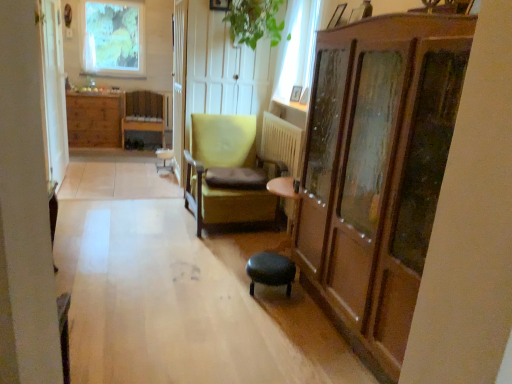
Measure the distance between wooden picture frame at upper right, arranged as the third picture frame when viewed from the front, and camera.

The depth of wooden picture frame at upper right, arranged as the third picture frame when viewed from the front, is 13.57 feet.

Find the location of `brown wood cabinet at left`. brown wood cabinet at left is located at coordinates (94, 120).

Where is `white wooden screen door at center, acting as the second screen door starting from the left`? white wooden screen door at center, acting as the second screen door starting from the left is located at coordinates (x=179, y=85).

This screenshot has height=384, width=512. What do you see at coordinates (271, 270) in the screenshot?
I see `black leather stool at center` at bounding box center [271, 270].

In order to face green fabric bar stool at center, should I rotate leftwards or rightwards?

A 12.160 degree turn to the left will do.

Measure the distance between metallic silver picture frame at upper right, which is counted as the 3th picture frame, starting from the left, and camera.

metallic silver picture frame at upper right, which is counted as the 3th picture frame, starting from the left, is 2.26 meters away from camera.

You are a GUI agent. You are given a task and a screenshot of the screen. Output one action in this format:
    pyautogui.click(x=<x>, y=<y>)
    Task: Click on the green leafy plant at upper center
    The image size is (512, 384).
    Given the screenshot: What is the action you would take?
    pyautogui.click(x=254, y=21)

Find the location of a particular element. The height and width of the screenshot is (384, 512). wooden picture frame at upper right, the second picture frame positioned from the right is located at coordinates coord(296,93).

Which point is more forward, (104, 97) or (305, 102)?

Point (305, 102)

Find the location of a particular element. The height and width of the screenshot is (384, 512). the 1st window directly above the brown wood cabinet at left (from a real-world perspective) is located at coordinates (297, 50).

Is brown wood cabinet at left taller than white glass window at upper center, which appears as the 2th window when viewed from the top?

In fact, brown wood cabinet at left may be shorter than white glass window at upper center, which appears as the 2th window when viewed from the top.

From a real-world perspective, is brown wood cabinet at left located beneath white glass window at upper center, arranged as the 1th window when viewed from the right?

Yes.

Is wooden cabinet at right positioned behind wooden picture frame at upper right, the second picture frame positioned from the right?

No, it is in front of wooden picture frame at upper right, the second picture frame positioned from the right.

Considering the relative positions of wooden cabinet at right and wooden picture frame at upper right, positioned as the second picture frame in left-to-right order, in the image provided, is wooden cabinet at right to the left or to the right of wooden picture frame at upper right, positioned as the second picture frame in left-to-right order,?

From the image, it's evident that wooden cabinet at right is to the right of wooden picture frame at upper right, positioned as the second picture frame in left-to-right order.

Considering the points (388, 127) and (291, 91), which point is in front, point (388, 127) or point (291, 91)?

The point (388, 127) is more forward.

Is brown wood cabinet at left not within matte yellow armchair at center, which ranks as the second chair in left-to-right order?

brown wood cabinet at left lies outside matte yellow armchair at center, which ranks as the second chair in left-to-right order,'s area.

From the picture: What's the angular difference between brown wood cabinet at left and matte yellow armchair at center, which is counted as the second chair, starting from the back,'s facing directions?

There is a 0.0551-degree angle between the facing directions of brown wood cabinet at left and matte yellow armchair at center, which is counted as the second chair, starting from the back.

Which object is positioned more to the right, brown wood cabinet at left or matte yellow armchair at center, the first chair positioned from the right?

matte yellow armchair at center, the first chair positioned from the right.

Which object is further away from the camera, brown wood cabinet at left or matte yellow armchair at center, which ranks as the second chair in left-to-right order?

Positioned behind is brown wood cabinet at left.

Which object is wider, white glass window at upper center, positioned as the 1th window in front-to-back order, or wooden cabinet at right?

With larger width is wooden cabinet at right.

Between point (298, 81) and point (439, 72), which one is positioned in front?

The point (439, 72) is closer to the camera.

Considering the relative positions of white glass window at upper center, which appears as the 1th window when ordered from the bottom, and wooden cabinet at right in the image provided, is white glass window at upper center, which appears as the 1th window when ordered from the bottom, to the left or to the right of wooden cabinet at right?

white glass window at upper center, which appears as the 1th window when ordered from the bottom, is to the left of wooden cabinet at right.

Can wooden cabinet at right be found inside white glass window at upper center, which appears as the 1th window when ordered from the bottom?

Actually, wooden cabinet at right is outside white glass window at upper center, which appears as the 1th window when ordered from the bottom.

From the image's perspective, which object appears higher, brown wood cabinet at left or green matte window at upper left, marked as the first window in a back-to-front arrangement?

green matte window at upper left, marked as the first window in a back-to-front arrangement, from the image's perspective.

Considering the relative sizes of brown wood cabinet at left and green matte window at upper left, the second window in the front-to-back sequence, in the image provided, is brown wood cabinet at left wider than green matte window at upper left, the second window in the front-to-back sequence,?

Yes, brown wood cabinet at left is wider than green matte window at upper left, the second window in the front-to-back sequence.

Considering the positions of point (69, 142) and point (127, 28), is point (69, 142) closer or farther from the camera than point (127, 28)?

Point (69, 142) is positioned closer to the camera compared to point (127, 28).

Which object is closer to the camera taking this photo, brown wood cabinet at left or green matte window at upper left, marked as the first window in a back-to-front arrangement?

brown wood cabinet at left is more forward.

Who is smaller, green leafy plant at upper center or metallic silver picture frame at upper right, the 1th picture frame in the front-to-back sequence?

Smaller between the two is metallic silver picture frame at upper right, the 1th picture frame in the front-to-back sequence.

Could you tell me if green leafy plant at upper center is facing metallic silver picture frame at upper right, the 2th picture frame viewed from the top?

No, green leafy plant at upper center does not turn towards metallic silver picture frame at upper right, the 2th picture frame viewed from the top.

From a real-world perspective, who is located higher, green leafy plant at upper center or metallic silver picture frame at upper right, which is counted as the 3th picture frame, starting from the left?

green leafy plant at upper center is physically above.

Could green matte window at upper left, the second window in the front-to-back sequence, be considered to be inside matte yellow armchair at center, which ranks as the second chair in left-to-right order?

No, green matte window at upper left, the second window in the front-to-back sequence, is not inside matte yellow armchair at center, which ranks as the second chair in left-to-right order.

Does matte yellow armchair at center, which is counted as the second chair, starting from the back, have a lesser height compared to green matte window at upper left, the 1th window in the top-to-bottom sequence?

Correct, matte yellow armchair at center, which is counted as the second chair, starting from the back, is not as tall as green matte window at upper left, the 1th window in the top-to-bottom sequence.

Is matte yellow armchair at center, the first chair positioned from the right, in contact with green matte window at upper left, which is counted as the 2th window, starting from the bottom?

No.

Which is behind, point (217, 152) or point (99, 43)?

The point (99, 43) is farther from the camera.

The height and width of the screenshot is (384, 512). In order to click on cabinetry located underneath the white glass window at upper center, arranged as the 1th window when viewed from the right (from a real-world perspective) in this screenshot , I will do `click(94, 120)`.

Where is `dresser located below the wooden picture frame at upper right, the first picture frame positioned from the back (from the image's perspective)`? The image size is (512, 384). dresser located below the wooden picture frame at upper right, the first picture frame positioned from the back (from the image's perspective) is located at coordinates (377, 171).

Based on their spatial positions, is white wood screen door at left, acting as the first screen door starting from the left, or white wooden screen door at center, the 1th screen door viewed from the right, further from black leather stool at center?

white wood screen door at left, acting as the first screen door starting from the left, is further to black leather stool at center.

Considering their positions, is white wooden screen door at center, acting as the second screen door starting from the left, positioned further to black leather stool at center than white glass window at upper center, which appears as the 1th window when ordered from the bottom?

white wooden screen door at center, acting as the second screen door starting from the left, is further to black leather stool at center.

Looking at the image, which one is located closer to wooden picture frame at upper center, which ranks as the second picture frame in back-to-front order, matte yellow armchair at center, which ranks as the second chair in left-to-right order, or green leafy plant at upper center?

green leafy plant at upper center.

Estimate the real-world distances between objects in this image. Which object is closer to green fabric bar stool at center, green fabric swivel chair at center or matte yellow armchair at center, which is counted as the 1th chair, starting from the front?

matte yellow armchair at center, which is counted as the 1th chair, starting from the front, is positioned closer to the anchor green fabric bar stool at center.

Consider the image. From the image, which object appears to be nearer to white glass window at upper center, which ranks as the second window in back-to-front order, green fabric swivel chair at center or metallic silver picture frame at upper right, the 2th picture frame positioned from the bottom?

The object closer to white glass window at upper center, which ranks as the second window in back-to-front order, is metallic silver picture frame at upper right, the 2th picture frame positioned from the bottom.

Consider the image. Considering their positions, is wooden chair at center, placed as the first chair when sorted from back to front, positioned closer to wooden cabinet at right than green fabric bar stool at center?

Among the two, green fabric bar stool at center is located nearer to wooden cabinet at right.

When comparing their distances from wooden chair at center, the 2th chair ordered from the bottom, does wooden picture frame at upper right, the first picture frame positioned from the back, or green leafy plant at upper center seem closer?

green leafy plant at upper center lies closer to wooden chair at center, the 2th chair ordered from the bottom, than the other object.

Based on their spatial positions, is brown wood cabinet at left or green fabric bar stool at center further from green leafy plant at upper center?

Based on the image, brown wood cabinet at left appears to be further to green leafy plant at upper center.

This screenshot has width=512, height=384. Identify the location of bar stool positioned between wooden picture frame at upper center, marked as the 1th picture frame in a left-to-right arrangement, and green matte window at upper left, marked as the first window in a back-to-front arrangement, from near to far. (164, 159).

The width and height of the screenshot is (512, 384). Identify the location of swivel chair positioned between wooden cabinet at right and green matte window at upper left, positioned as the second window in right-to-left order, from near to far. (270, 270).

This screenshot has height=384, width=512. What are the coordinates of `plant between metallic silver picture frame at upper right, which appears as the third picture frame when viewed from the back, and white wooden screen door at center, the 1th screen door viewed from the right, in the front-back direction` in the screenshot? It's located at (254, 21).

Find the location of a particular element. The image size is (512, 384). picture frame between white wooden screen door at center, the 1th screen door viewed from the right, and white glass window at upper center, positioned as the 1th window in front-to-back order, from left to right is located at coordinates (220, 5).